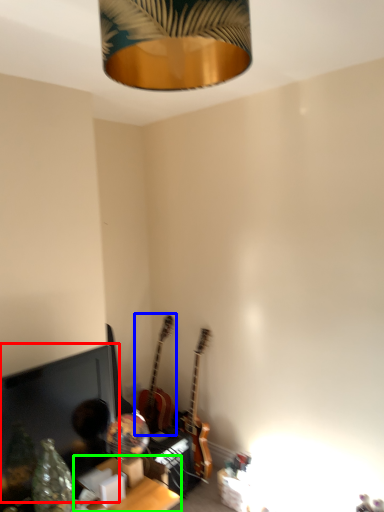
Question: Which object is the closest to the computer monitor (highlighted by a red box)? Choose among these: guitar (highlighted by a blue box) or table (highlighted by a green box).

Choices:
 (A) guitar
 (B) table

Answer: (B)